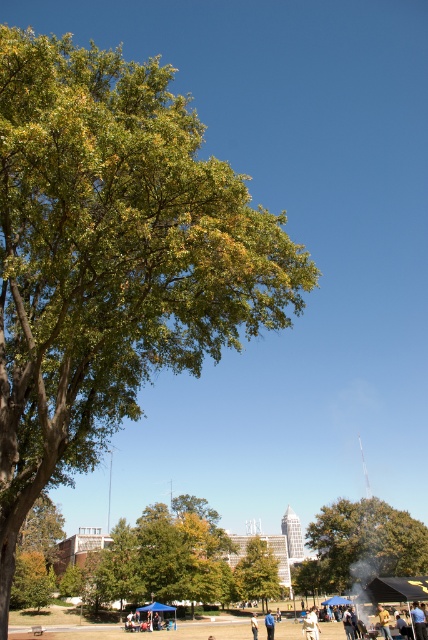
Can you confirm if green matte tree at center is smaller than yellow fabric at lower center?

Incorrect, green matte tree at center is not smaller in size than yellow fabric at lower center.

Does green matte tree at center appear on the right side of yellow fabric at lower center?

In fact, green matte tree at center is to the left of yellow fabric at lower center.

Locate an element on the screen. The height and width of the screenshot is (640, 428). green matte tree at center is located at coordinates (256, 572).

Does blue fabric umbrella at center have a smaller size compared to light brown leather jacket at center?

Result: Actually, blue fabric umbrella at center might be larger than light brown leather jacket at center.

Can you confirm if blue fabric umbrella at center is wider than light brown leather jacket at center?

Yes.

Image resolution: width=428 pixels, height=640 pixels. What are the coordinates of `blue fabric umbrella at center` in the screenshot? It's located at (270, 625).

Measure the distance from green leafy tree at upper left to green leafy tree at lower right.

green leafy tree at upper left and green leafy tree at lower right are 189.44 feet apart from each other.

Is point (264, 278) farther from viewer compared to point (323, 582)?

No, (264, 278) is closer to viewer.

The image size is (428, 640). Identify the location of green leafy tree at upper left. (112, 257).